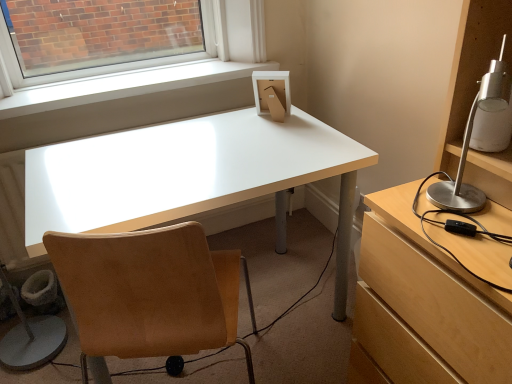
Question: Is point (205, 117) positioned closer to the camera than point (434, 185)?

Choices:
 (A) farther
 (B) closer

Answer: (A)

Question: From a real-world perspective, is white glossy desk at center above or below silver metallic lamp at right?

Choices:
 (A) below
 (B) above

Answer: (A)

Question: Which object is the farthest from the white glossy desk at center?

Choices:
 (A) tan suede chair at center
 (B) silver metallic lamp at right
 (C) white smooth window sill at upper center

Answer: (B)

Question: Which object is positioned closest to the tan suede chair at center?

Choices:
 (A) white glossy desk at center
 (B) silver metallic lamp at right
 (C) white smooth window sill at upper center

Answer: (A)